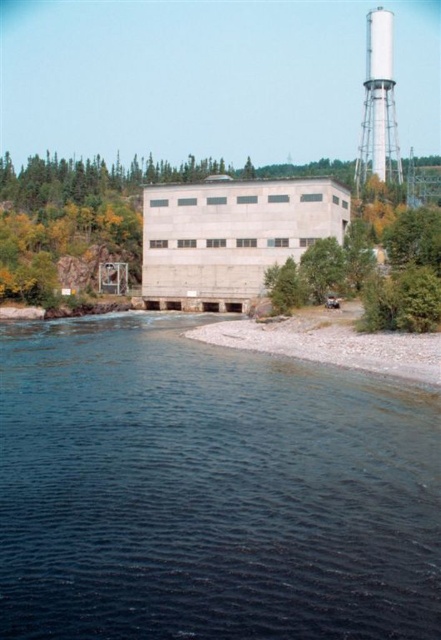
Question: Which point appears closest to the camera in this image?

Choices:
 (A) (265, 387)
 (B) (198, 330)

Answer: (A)

Question: Is dark blue water at lower center closer to the viewer compared to white smooth water tower at upper right?

Choices:
 (A) yes
 (B) no

Answer: (A)

Question: Where is smooth gravel shoreline at lower right located in relation to white smooth water tower at upper right in the image?

Choices:
 (A) above
 (B) below

Answer: (B)

Question: Which of the following is the farthest from the observer?

Choices:
 (A) (335, 362)
 (B) (216, 588)

Answer: (A)

Question: Is dark blue water at lower center thinner than smooth gravel shoreline at lower right?

Choices:
 (A) no
 (B) yes

Answer: (A)

Question: Considering the real-world distances, which object is farthest from the white smooth water tower at upper right?

Choices:
 (A) dark blue water at lower center
 (B) smooth gravel shoreline at lower right

Answer: (A)